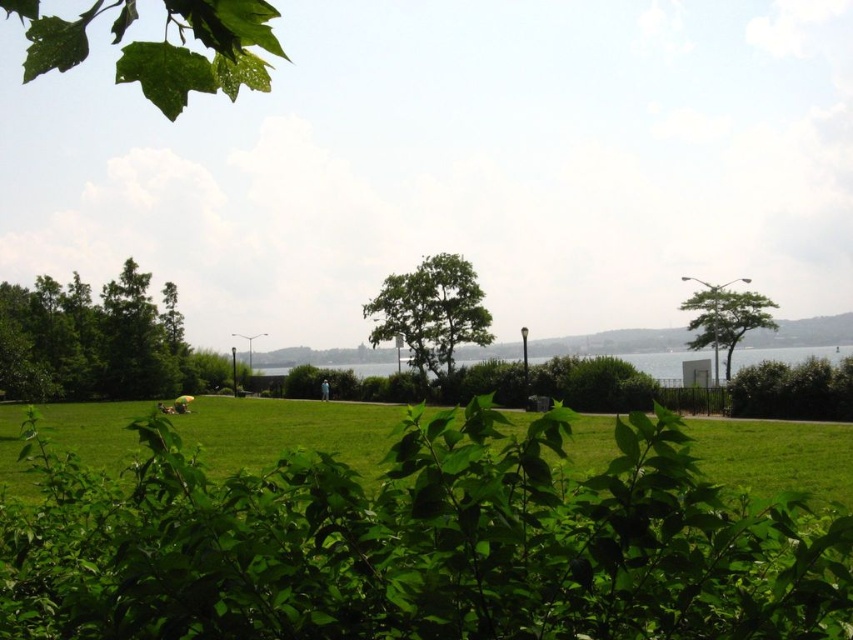
Who is lower down, green leafy bush at center or green leafy bush at right?

green leafy bush at right is below.

Identify the location of green leafy bush at center. (x=418, y=544).

From the picture: Between green leafy tree at left and green leafy bush at right, which one appears on the right side from the viewer's perspective?

green leafy bush at right is more to the right.

Can you confirm if green leafy tree at left is wider than green leafy bush at right?

Yes, green leafy tree at left is wider than green leafy bush at right.

Describe the element at coordinates (90, 340) in the screenshot. The height and width of the screenshot is (640, 853). I see `green leafy tree at left` at that location.

Find the location of a particular element. green leafy tree at left is located at coordinates (90, 340).

Does green leafy bush at center appear under green glossy leaf at upper left?

Yes, green leafy bush at center is below green glossy leaf at upper left.

Is point (711, 502) in front of point (218, 64)?

No, (711, 502) is further to viewer.

This screenshot has width=853, height=640. I want to click on green leafy bush at center, so click(418, 544).